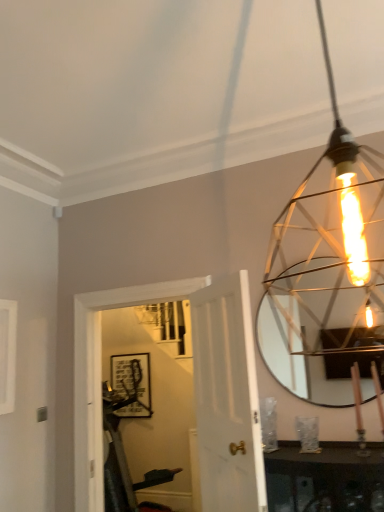
This screenshot has width=384, height=512. Describe the element at coordinates (227, 398) in the screenshot. I see `white wood door at center` at that location.

What is the approximate width of matte black picture frame at center?

It is 1.93 inches.

The height and width of the screenshot is (512, 384). Find the location of `metallic silver mirror at upper right`. metallic silver mirror at upper right is located at coordinates (307, 362).

Is matte black picture frame at center positioned beyond the bounds of matte gold wire cage at upper right?

Yes, matte black picture frame at center is located beyond the bounds of matte gold wire cage at upper right.

Which object is positioned more to the left, matte black picture frame at center or matte gold wire cage at upper right?

Positioned to the left is matte black picture frame at center.

Which is nearer, (121, 394) or (364, 291)?

Point (121, 394).

From a real-world perspective, is matte black picture frame at center located higher than matte gold wire cage at upper right?

No.

Relative to metallic silver mirror at upper right, is matte gold wire cage at upper right in front or behind?

matte gold wire cage at upper right is in front of metallic silver mirror at upper right.

In the scene shown: Between matte gold wire cage at upper right and metallic silver mirror at upper right, which one has smaller width?

Thinner between the two is metallic silver mirror at upper right.

Considering the relative sizes of matte gold wire cage at upper right and metallic silver mirror at upper right in the image provided, is matte gold wire cage at upper right bigger than metallic silver mirror at upper right?

Indeed, matte gold wire cage at upper right has a larger size compared to metallic silver mirror at upper right.

Does point (363, 378) appear closer or farther from the camera than point (265, 355)?

Point (363, 378) is positioned closer to the camera compared to point (265, 355).

From the image's perspective, would you say metallic silver mirror at upper right is shown under white wood door at center?

No.

From a real-world perspective, is metallic silver mirror at upper right below white wood door at center?

No, from a real-world perspective, metallic silver mirror at upper right is not beneath white wood door at center.

Which of these two, metallic silver mirror at upper right or white wood door at center, is thinner?

Thinner between the two is metallic silver mirror at upper right.

Between metallic silver mirror at upper right and white wood door at center, which one appears on the right side from the viewer's perspective?

metallic silver mirror at upper right is more to the right.

Identify the location of lamp that appears on the left of metallic silver mirror at upper right. (328, 272).

Which object is wider, metallic silver mirror at upper right or matte gold wire cage at upper right?

matte gold wire cage at upper right is wider.

From the image's perspective, is metallic silver mirror at upper right located above or below matte gold wire cage at upper right?

metallic silver mirror at upper right is below matte gold wire cage at upper right.

Is metallic silver mirror at upper right not inside matte gold wire cage at upper right?

Indeed, metallic silver mirror at upper right is completely outside matte gold wire cage at upper right.

Does white wood door at center have a greater height compared to matte black picture frame at center?

Yes, white wood door at center is taller than matte black picture frame at center.

From the image's perspective, is white wood door at center above matte black picture frame at center?

Indeed, from the image's perspective, white wood door at center is shown above matte black picture frame at center.

Is point (212, 424) farther from camera compared to point (136, 402)?

No, (212, 424) is in front of (136, 402).

Is white wood door at center in contact with matte black picture frame at center?

They are not placed beside each other.

From the image's perspective, which is above, matte gold wire cage at upper right or white wood door at center?

matte gold wire cage at upper right appears higher in the image.

Is matte gold wire cage at upper right at the right side of white wood door at center?

Yes.

You are a GUI agent. You are given a task and a screenshot of the screen. Output one action in this format:
    pyautogui.click(x=<x>, y=<y>)
    Task: Click on the lamp that is above the white wood door at center (from a real-world perspective)
    
    Given the screenshot: What is the action you would take?
    [x=328, y=272]

Are matte gold wire cage at upper right and white wood door at center beside each other?

matte gold wire cage at upper right and white wood door at center are clearly separated.

From the image's perspective, who appears lower, matte black picture frame at center or white wood door at center?

matte black picture frame at center appears lower in the image.

What's the angular difference between matte black picture frame at center and white wood door at center's facing directions?

There is a 49.7-degree angle between the facing directions of matte black picture frame at center and white wood door at center.

Is matte black picture frame at center beside white wood door at center?

No, matte black picture frame at center is not in contact with white wood door at center.

In terms of height, does matte black picture frame at center look taller or shorter compared to white wood door at center?

Clearly, matte black picture frame at center is shorter compared to white wood door at center.

Locate an element on the screen. The height and width of the screenshot is (512, 384). picture frame below the matte gold wire cage at upper right (from the image's perspective) is located at coordinates (132, 384).

Find the location of a particular element. The width and height of the screenshot is (384, 512). mirror behind the matte gold wire cage at upper right is located at coordinates (307, 362).

Based on their spatial positions, is matte black picture frame at center or white wood door at center closer to matte gold wire cage at upper right?

The object closer to matte gold wire cage at upper right is white wood door at center.

Looking at this image, which object lies further to the anchor point matte black picture frame at center, white wood door at center or metallic silver mirror at upper right?

The object further to matte black picture frame at center is white wood door at center.

From the image, which object appears to be farther from metallic silver mirror at upper right, matte gold wire cage at upper right or matte black picture frame at center?

matte black picture frame at center is positioned further to the anchor metallic silver mirror at upper right.

When comparing their distances from matte black picture frame at center, does metallic silver mirror at upper right or white wood door at center seem further?

white wood door at center lies further to matte black picture frame at center than the other object.

Based on their spatial positions, is white wood door at center or matte gold wire cage at upper right closer to matte black picture frame at center?

matte gold wire cage at upper right is positioned closer to the anchor matte black picture frame at center.

Considering their positions, is metallic silver mirror at upper right positioned further to matte gold wire cage at upper right than matte black picture frame at center?

matte black picture frame at center is further to matte gold wire cage at upper right.

Based on their spatial positions, is matte black picture frame at center or matte gold wire cage at upper right closer to metallic silver mirror at upper right?

Based on the image, matte gold wire cage at upper right appears to be nearer to metallic silver mirror at upper right.

Looking at the image, which one is located closer to matte gold wire cage at upper right, white wood door at center or metallic silver mirror at upper right?

metallic silver mirror at upper right.

Identify the location of door between matte gold wire cage at upper right and matte black picture frame at center along the z-axis. The width and height of the screenshot is (384, 512). (227, 398).

Identify the location of mirror between matte gold wire cage at upper right and matte black picture frame at center in the front-back direction. (307, 362).

The height and width of the screenshot is (512, 384). In order to click on mirror between white wood door at center and matte black picture frame at center from front to back in this screenshot , I will do `click(307, 362)`.

The width and height of the screenshot is (384, 512). I want to click on door located between matte gold wire cage at upper right and metallic silver mirror at upper right in the depth direction, so click(x=227, y=398).